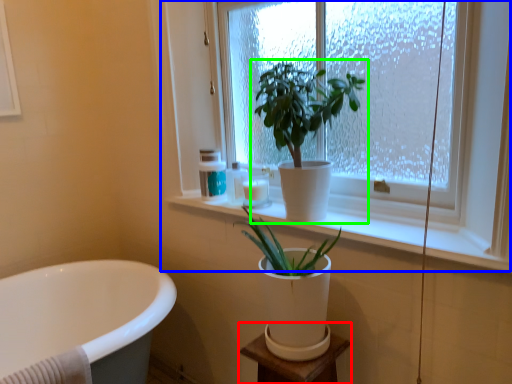
Question: Which object is positioned closest to vanity (highlighted by a red box)? Select from window (highlighted by a blue box) and houseplant (highlighted by a green box).

Choices:
 (A) window
 (B) houseplant

Answer: (B)